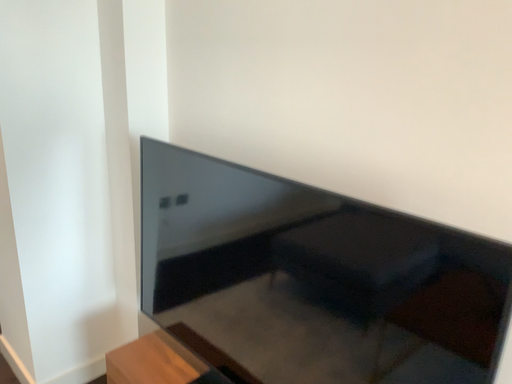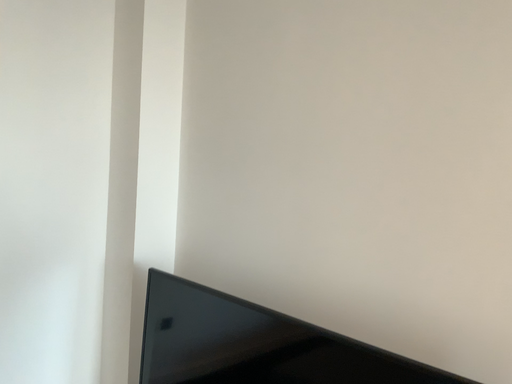
Question: Which way did the camera rotate in the video?

Choices:
 (A) rotated downward
 (B) rotated upward

Answer: (B)